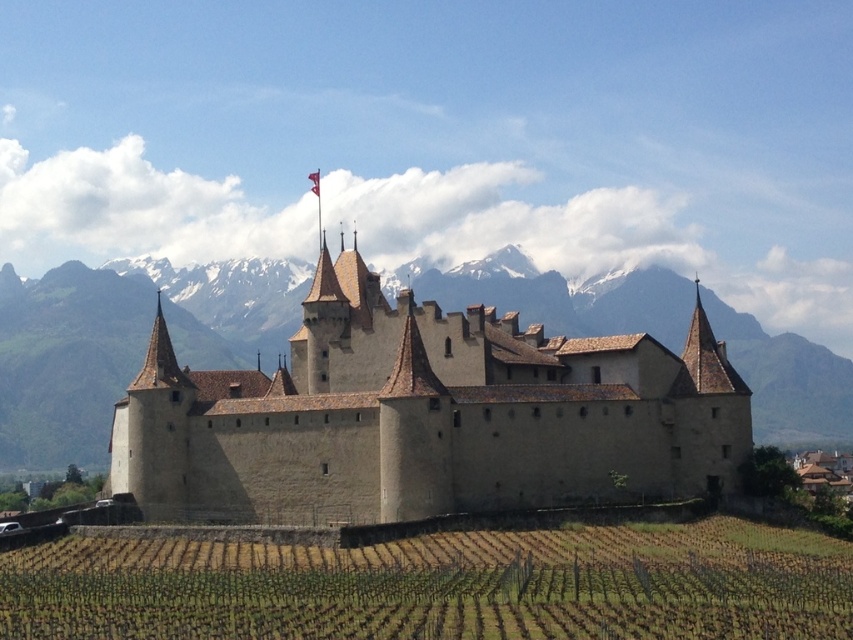
You are standing at the point marked as point [426,417] in the image. What object is exactly at that location?

The beige stone castle at center is exactly at point [426,417].

You are standing at the base of the castle hill and see two points marked in the image. The first point is at coordinates point [523,472] and the second point is at point [828,563]. Which of these points is closer to you?

Point [523,472] is closer to you because it is further to the viewer than point [828,563].

You are a visitor standing at the base of the hill where the green grassy vineyard at lower center is located. You want to take a photo of the beige stone castle at center. Since the castle is larger in the scene, will it occupy more space in your photo compared to the vineyard?

The beige stone castle at center has a larger size compared to the green grassy vineyard at lower center, so it will occupy more space in the photo.